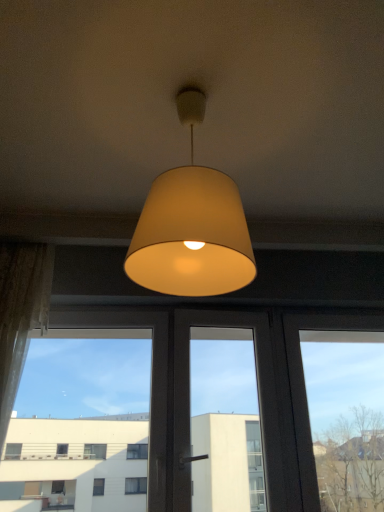
Question: Is sheer lace curtain at left taller than matte beige lampshade at center?

Choices:
 (A) no
 (B) yes

Answer: (B)

Question: Can you see sheer lace curtain at left touching matte beige lampshade at center?

Choices:
 (A) yes
 (B) no

Answer: (B)

Question: Can you confirm if sheer lace curtain at left is positioned to the right of matte beige lampshade at center?

Choices:
 (A) yes
 (B) no

Answer: (B)

Question: Is sheer lace curtain at left turned away from matte beige lampshade at center?

Choices:
 (A) no
 (B) yes

Answer: (A)

Question: Can we say sheer lace curtain at left lies outside matte beige lampshade at center?

Choices:
 (A) no
 (B) yes

Answer: (B)

Question: Is transparent glass window at center spatially inside sheer lace curtain at left, or outside of it?

Choices:
 (A) outside
 (B) inside

Answer: (A)

Question: Considering the positions of transparent glass window at center and sheer lace curtain at left in the image, is transparent glass window at center taller or shorter than sheer lace curtain at left?

Choices:
 (A) short
 (B) tall

Answer: (A)

Question: Relative to sheer lace curtain at left, is transparent glass window at center in front or behind?

Choices:
 (A) front
 (B) behind

Answer: (B)

Question: From a real-world perspective, is transparent glass window at center physically located above or below sheer lace curtain at left?

Choices:
 (A) below
 (B) above

Answer: (A)

Question: From the image's perspective, is matte beige lampshade at center above or below sheer lace curtain at left?

Choices:
 (A) above
 (B) below

Answer: (A)

Question: In terms of height, does matte beige lampshade at center look taller or shorter compared to sheer lace curtain at left?

Choices:
 (A) tall
 (B) short

Answer: (B)

Question: Considering the relative positions of matte beige lampshade at center and sheer lace curtain at left in the image provided, is matte beige lampshade at center to the left or to the right of sheer lace curtain at left?

Choices:
 (A) right
 (B) left

Answer: (A)

Question: Does point (218, 194) appear closer or farther from the camera than point (3, 331)?

Choices:
 (A) farther
 (B) closer

Answer: (B)

Question: Considering the positions of transparent glass window at center and matte beige lampshade at center in the image, is transparent glass window at center wider or thinner than matte beige lampshade at center?

Choices:
 (A) wide
 (B) thin

Answer: (B)

Question: Is transparent glass window at center taller or shorter than matte beige lampshade at center?

Choices:
 (A) short
 (B) tall

Answer: (B)